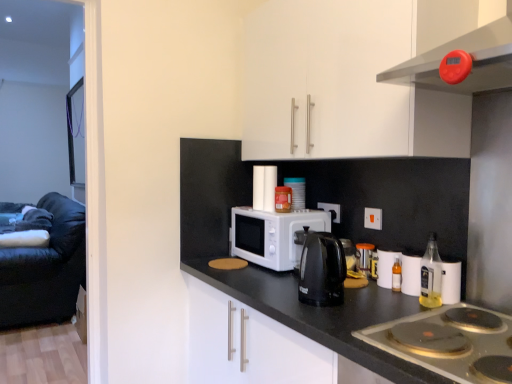
You are a GUI agent. You are given a task and a screenshot of the screen. Output one action in this format:
    pyautogui.click(x=<x>, y=<y>)
    Task: Click on the vacant space in front of translucent plastic bottle at lower right, which ranks as the 2th appliance in left-to-right order
    The image size is (512, 384).
    Given the screenshot: What is the action you would take?
    pyautogui.click(x=395, y=292)